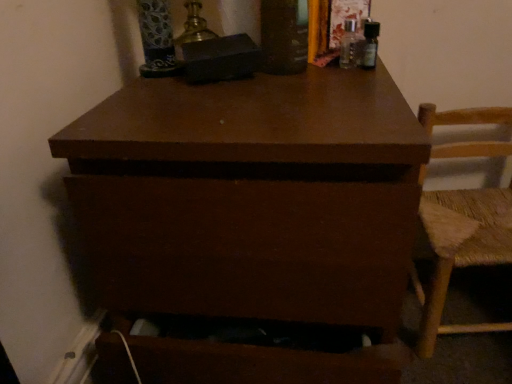
You are a GUI agent. You are given a task and a screenshot of the screen. Output one action in this format:
    pyautogui.click(x=<x>, y=<y>)
    Task: Click on the brown matte chest of drawers at center
    Image resolution: width=512 pixels, height=384 pixels.
    Given the screenshot: What is the action you would take?
    pyautogui.click(x=251, y=215)

The image size is (512, 384). What do you see at coordinates (251, 215) in the screenshot?
I see `brown matte chest of drawers at center` at bounding box center [251, 215].

Describe the element at coordinates (460, 250) in the screenshot. I see `woven straw chair at right` at that location.

In order to face woven straw chair at right, should I rotate leftwards or rightwards?

It's best to rotate right around 28.362 degrees.

Locate an element on the screen. woven straw chair at right is located at coordinates (460, 250).

You are a GUI agent. You are given a task and a screenshot of the screen. Output one action in this format:
    pyautogui.click(x=<x>, y=<y>)
    Task: Click on the brown matte chest of drawers at center
    The height and width of the screenshot is (384, 512).
    Given the screenshot: What is the action you would take?
    pyautogui.click(x=251, y=215)

Between woven straw chair at right and brown matte chest of drawers at center, which one appears on the left side from the viewer's perspective?

brown matte chest of drawers at center.

Is woven straw chair at right behind brown matte chest of drawers at center?

That is True.

Between point (444, 287) and point (397, 260), which one is positioned behind?

The point (444, 287) is farther.

From the image's perspective, is woven straw chair at right above or below brown matte chest of drawers at center?

From the image's perspective, woven straw chair at right appears below brown matte chest of drawers at center.

From a real-world perspective, is woven straw chair at right located higher than brown matte chest of drawers at center?

No.

Does woven straw chair at right have a lesser width compared to brown matte chest of drawers at center?

Yes.

Consider the image. Which of these two, woven straw chair at right or brown matte chest of drawers at center, stands taller?

With more height is brown matte chest of drawers at center.

Is woven straw chair at right bigger than brown matte chest of drawers at center?

No, woven straw chair at right is not bigger than brown matte chest of drawers at center.

Is woven straw chair at right situated inside brown matte chest of drawers at center or outside?

woven straw chair at right lies outside brown matte chest of drawers at center.

Is woven straw chair at right with brown matte chest of drawers at center?

No, woven straw chair at right is not with brown matte chest of drawers at center.

Is woven straw chair at right facing away from brown matte chest of drawers at center?

No, woven straw chair at right is not facing away from brown matte chest of drawers at center.

How distant is woven straw chair at right from brown matte chest of drawers at center?

They are 16.04 inches apart.

Locate an element on the screen. chair below the brown matte chest of drawers at center (from a real-world perspective) is located at coordinates (460, 250).

Does brown matte chest of drawers at center appear on the left side of woven straw chair at right?

Yes, brown matte chest of drawers at center is to the left of woven straw chair at right.

From the picture: Is brown matte chest of drawers at center positioned before woven straw chair at right?

Yes, brown matte chest of drawers at center is in front of woven straw chair at right.

Is point (205, 305) closer or farther from the camera than point (443, 203)?

Point (205, 305) is closer to the camera than point (443, 203).

From the image's perspective, is brown matte chest of drawers at center under woven straw chair at right?

A: No.

From a real-world perspective, relative to woven straw chair at right, is brown matte chest of drawers at center vertically above or below?

In terms of real-world spatial position, brown matte chest of drawers at center is above woven straw chair at right.

Considering the sizes of objects brown matte chest of drawers at center and woven straw chair at right in the image provided, who is wider, brown matte chest of drawers at center or woven straw chair at right?

brown matte chest of drawers at center is wider.

Consider the image. Between brown matte chest of drawers at center and woven straw chair at right, which one has more height?

brown matte chest of drawers at center is taller.

Does brown matte chest of drawers at center have a smaller size compared to woven straw chair at right?

No.

Is brown matte chest of drawers at center spatially inside woven straw chair at right, or outside of it?

brown matte chest of drawers at center is outside woven straw chair at right.

Is brown matte chest of drawers at center in contact with woven straw chair at right?

No, brown matte chest of drawers at center is not beside woven straw chair at right.

Is brown matte chest of drawers at center turned away from woven straw chair at right?

No, woven straw chair at right is not at the back of brown matte chest of drawers at center.

At what (x,y) coordinates should I click in order to perform the action: click on chair located underneath the brown matte chest of drawers at center (from a real-world perspective). Please return your answer as a coordinate pair (x, y). The width and height of the screenshot is (512, 384). Looking at the image, I should click on (460, 250).

You are a GUI agent. You are given a task and a screenshot of the screen. Output one action in this format:
    pyautogui.click(x=<x>, y=<y>)
    Task: Click on the chair lying on the right of brown matte chest of drawers at center
    Image resolution: width=512 pixels, height=384 pixels.
    Given the screenshot: What is the action you would take?
    pyautogui.click(x=460, y=250)

Find the location of `the chest of drawers that is above the woven straw chair at right (from the image's perspective)`. the chest of drawers that is above the woven straw chair at right (from the image's perspective) is located at coordinates [251, 215].